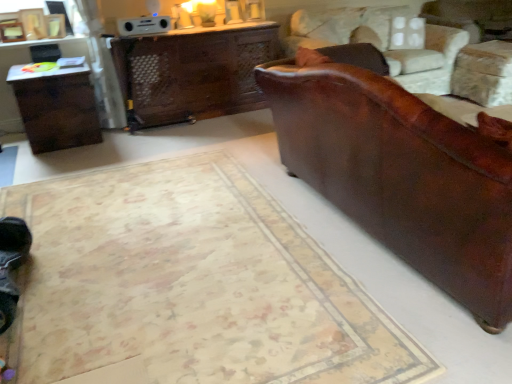
Locate an element on the screen. The image size is (512, 384). vacant space in front of wooden desk at center is located at coordinates (185, 147).